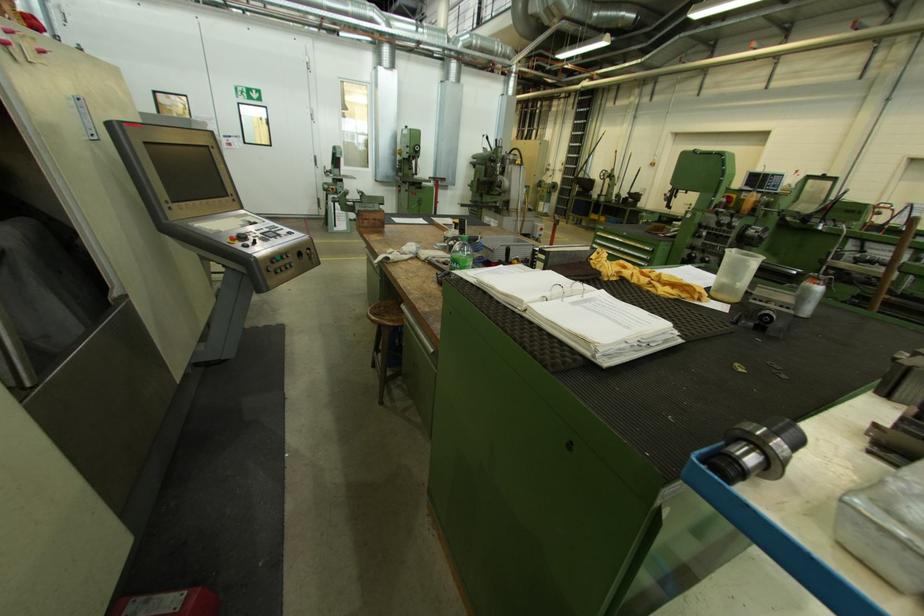
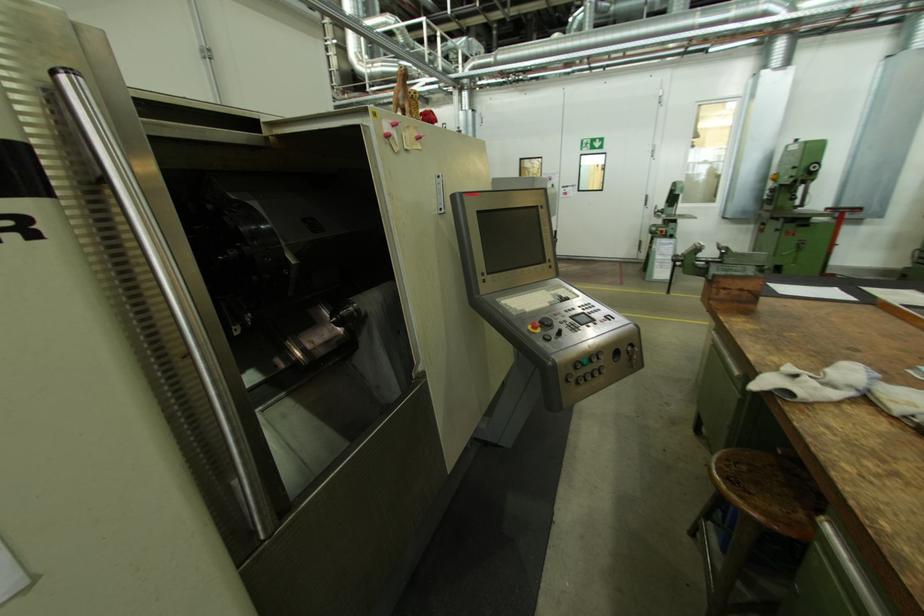
The point at (390, 317) is marked in the first image. Where is the corresponding point in the second image?

(755, 493)